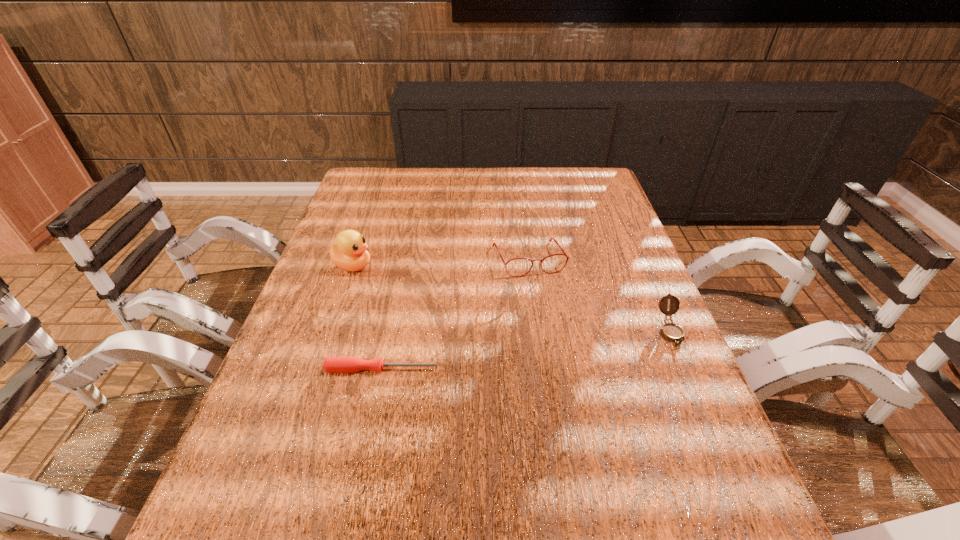
You are a GUI agent. You are given a task and a screenshot of the screen. Output one action in this format:
    pyautogui.click(x=<x>, y=<y>)
    Task: Click on the free space at the right edge of the desktop
    
    Given the screenshot: What is the action you would take?
    pyautogui.click(x=616, y=257)

This screenshot has width=960, height=540. Find the location of `free location at the far left corner of the desktop`. free location at the far left corner of the desktop is located at coordinates (369, 201).

Where is `vacant space at the near right corner of the desktop`? This screenshot has height=540, width=960. vacant space at the near right corner of the desktop is located at coordinates (720, 449).

Where is `vacant area that lies between the duckling and the shortest object`? This screenshot has width=960, height=540. vacant area that lies between the duckling and the shortest object is located at coordinates (368, 317).

Where is `free space between the second nearest object and the screwdriver`? free space between the second nearest object and the screwdriver is located at coordinates (526, 350).

This screenshot has width=960, height=540. I want to click on vacant area that lies between the nearest object and the duckling, so click(x=368, y=317).

Where is `vacant area that lies between the screwdriver and the compass`? vacant area that lies between the screwdriver and the compass is located at coordinates (526, 350).

Where is `free space between the nearest object and the third object from left to right`? This screenshot has width=960, height=540. free space between the nearest object and the third object from left to right is located at coordinates (455, 314).

You are a GUI agent. You are given a task and a screenshot of the screen. Output one action in this format:
    pyautogui.click(x=<x>, y=<y>)
    Task: Click on the vacant region between the screwdriver and the third farthest object
    
    Given the screenshot: What is the action you would take?
    pyautogui.click(x=526, y=350)

Where is `empty space that is in between the shortest object and the third farthest object`? empty space that is in between the shortest object and the third farthest object is located at coordinates (526, 350).